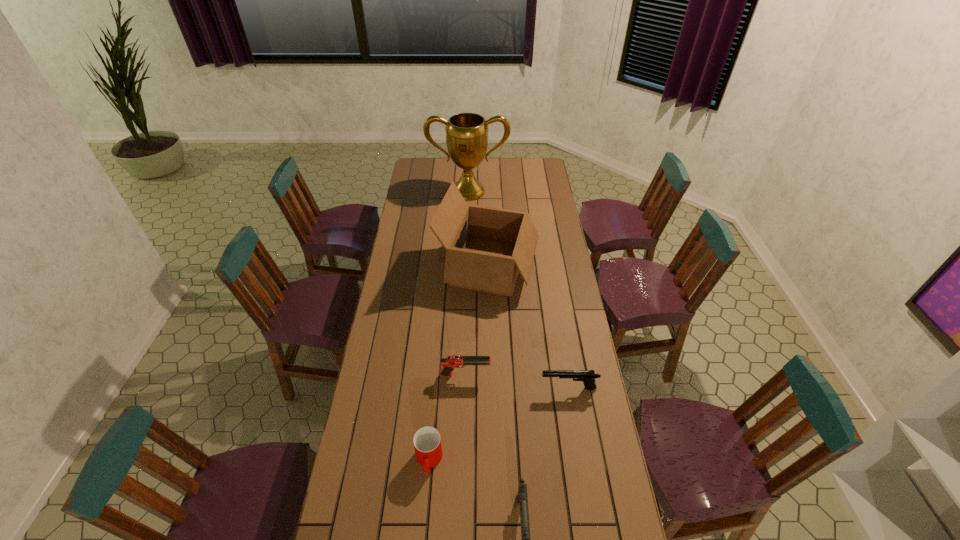
This screenshot has width=960, height=540. Identify the location of free location located 0.250m on the front of the box. [490, 355].

The width and height of the screenshot is (960, 540). What are the coordinates of `free space located 0.200m at the aiming end of the farthest gun` in the screenshot? It's located at (543, 375).

Find the location of `free point located 0.140m on the side of the second nearest object with the handle`. free point located 0.140m on the side of the second nearest object with the handle is located at coordinates (423, 528).

Where is `vacant space located at the aiming end of the rightmost gun`? vacant space located at the aiming end of the rightmost gun is located at coordinates (478, 388).

Where is `free location located at the aiming end of the rightmost gun`? The width and height of the screenshot is (960, 540). free location located at the aiming end of the rightmost gun is located at coordinates (456, 388).

In order to click on free location located 0.400m at the aiming end of the rightmost gun in this screenshot , I will do `click(431, 388)`.

Image resolution: width=960 pixels, height=540 pixels. What are the coordinates of `object located at the left edge` in the screenshot? It's located at (466, 133).

Find the location of a particular element. box at the right edge is located at coordinates (486, 247).

Locate an element on the screen. This screenshot has width=960, height=540. gun located in the right edge section of the desktop is located at coordinates (588, 377).

In the image, there is a desktop. Identify the location of free space at the far edge. Image resolution: width=960 pixels, height=540 pixels. (504, 177).